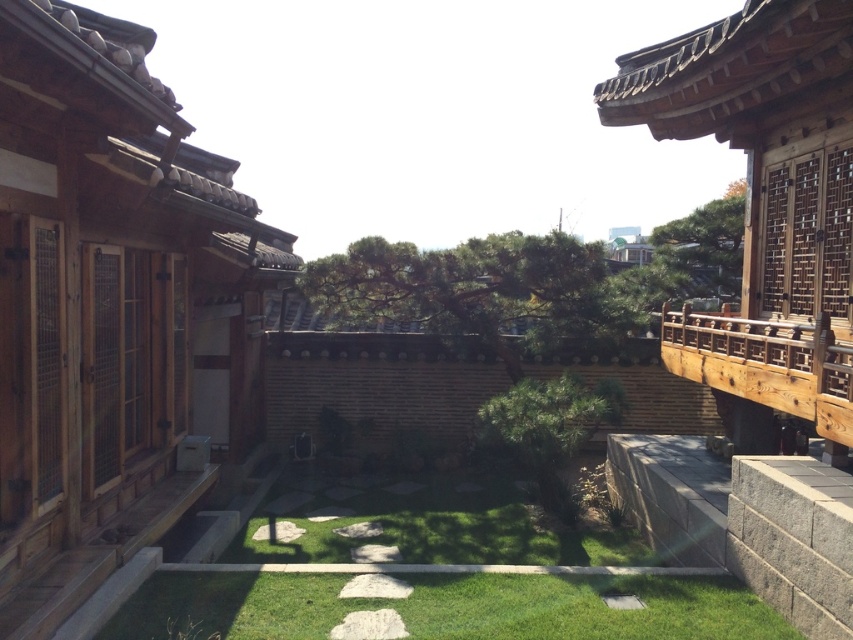
Who is lower down, wooden terrace at left or green grass at center?

green grass at center is lower down.

Which of these two, wooden terrace at left or green grass at center, stands taller?

With more height is wooden terrace at left.

Locate an element on the screen. Image resolution: width=853 pixels, height=640 pixels. wooden terrace at left is located at coordinates (111, 307).

The width and height of the screenshot is (853, 640). Identify the location of wooden terrace at left. (111, 307).